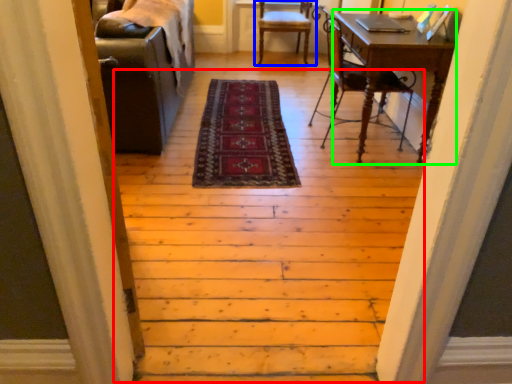
Question: Estimate the real-world distances between objects in this image. Which object is closer to stairwell (highlighted by a red box), chair (highlighted by a blue box) or computer desk (highlighted by a green box)?

Choices:
 (A) chair
 (B) computer desk

Answer: (B)